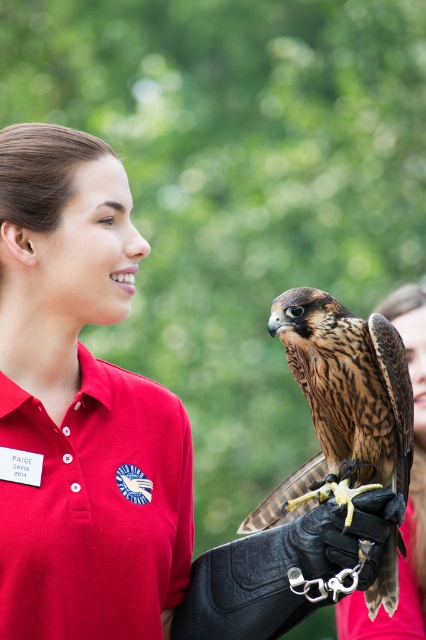
Question: Which of these objects is positioned farthest from the matte red polo shirt at center?

Choices:
 (A) brown speckled feathers at center
 (B) matte red glove at center

Answer: (B)

Question: Is brown speckled feathers at center positioned at the back of matte red glove at center?

Choices:
 (A) no
 (B) yes

Answer: (A)

Question: Which object is farther from the camera taking this photo?

Choices:
 (A) matte red glove at center
 (B) brown speckled feathers at center

Answer: (A)

Question: Can you confirm if matte red polo shirt at center is positioned above matte red glove at center?

Choices:
 (A) no
 (B) yes

Answer: (B)

Question: Is brown speckled feathers at center thinner than matte red glove at center?

Choices:
 (A) no
 (B) yes

Answer: (B)

Question: Which point is closer to the camera taking this photo?

Choices:
 (A) (370, 632)
 (B) (408, 480)

Answer: (B)